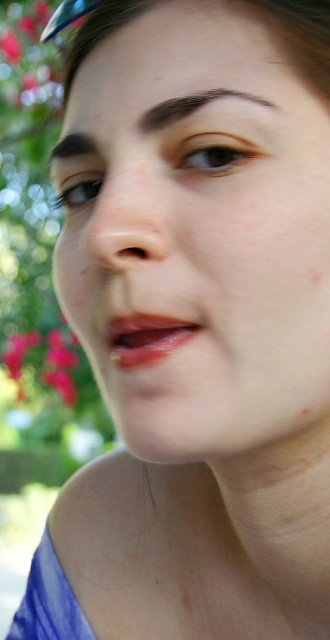
Does smooth skin face at center appear on the left side of bright pink petals at lower left?

Incorrect, smooth skin face at center is not on the left side of bright pink petals at lower left.

Is the position of smooth skin face at center less distant than that of bright pink petals at lower left?

That is True.

The width and height of the screenshot is (330, 640). What do you see at coordinates (197, 228) in the screenshot?
I see `smooth skin face at center` at bounding box center [197, 228].

Locate an element on the screen. This screenshot has width=330, height=640. smooth skin face at center is located at coordinates (197, 228).